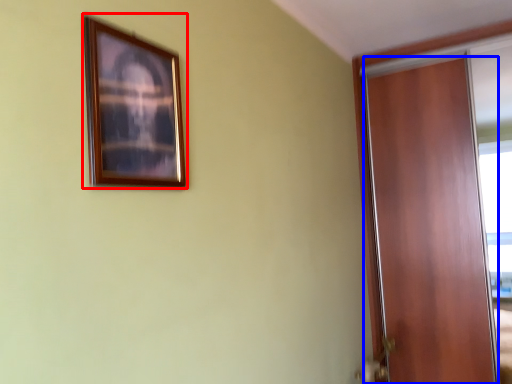
Question: Which point is further to the camera, picture frame (highlighted by a red box) or door (highlighted by a blue box)?

Choices:
 (A) picture frame
 (B) door

Answer: (B)